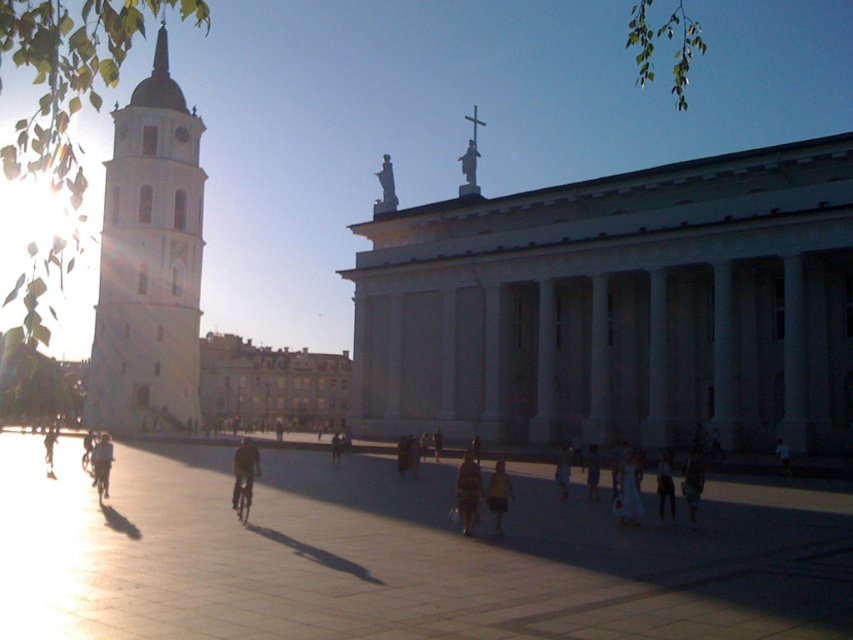
Which is more to the right, yellow fabric dress at center or metallic silver bicycle at center?

Positioned to the right is yellow fabric dress at center.

Who is taller, yellow fabric dress at center or metallic silver bicycle at center?

yellow fabric dress at center

What are the coordinates of `yellow fabric dress at center` in the screenshot? It's located at (498, 493).

Can you confirm if light brown leather jacket at lower right is thinner than dark gray pants at center?

In fact, light brown leather jacket at lower right might be wider than dark gray pants at center.

Does point (666, 474) come behind point (788, 468)?

No.

I want to click on light brown leather jacket at lower right, so click(665, 484).

Can you confirm if white stone tower at left is shorter than dark blue fabric bicycle at center?

In fact, white stone tower at left may be taller than dark blue fabric bicycle at center.

Who is more forward, [96,358] or [238,497]?

Point [238,497] is more forward.

Where is `white stone tower at left`? The height and width of the screenshot is (640, 853). white stone tower at left is located at coordinates (149, 262).